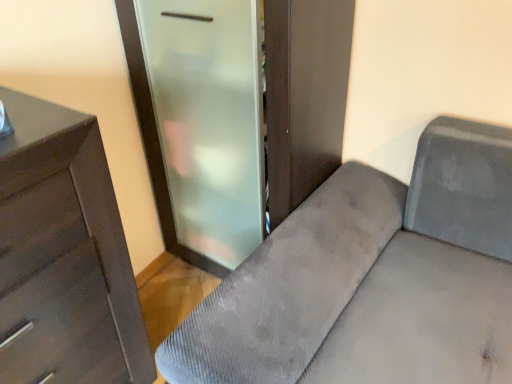
Question: Should I look upward or downward to see matte brown chest of drawers at left?

Choices:
 (A) down
 (B) up

Answer: (A)